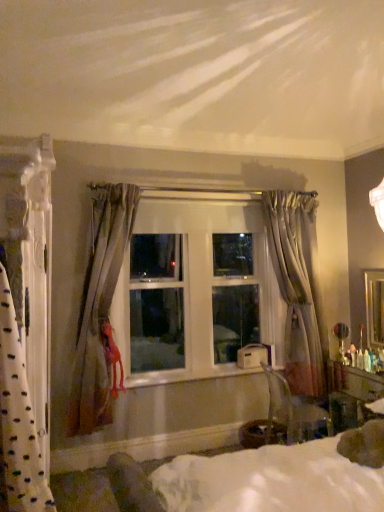
Where is `white textured curtain at left, which appears as the third curtain when viewed from the right`? Image resolution: width=384 pixels, height=512 pixels. white textured curtain at left, which appears as the third curtain when viewed from the right is located at coordinates (26, 321).

Image resolution: width=384 pixels, height=512 pixels. I want to click on white painted wood at center, so click(190, 375).

This screenshot has height=512, width=384. What do you see at coordinates (298, 287) in the screenshot?
I see `sheer gray curtain at right, which appears as the 1th curtain when viewed from the right` at bounding box center [298, 287].

Describe the element at coordinates (350, 394) in the screenshot. I see `wooden glossy vanity at lower right` at that location.

The image size is (384, 512). In order to click on silver metallic mirror at right in this screenshot , I will do `click(374, 308)`.

Find the location of a particular element. metallic silver table lamp at right is located at coordinates (341, 339).

Locate an element on the screen. The height and width of the screenshot is (512, 384). white textured curtain at left, which is counted as the first curtain, starting from the left is located at coordinates (26, 321).

Which is correct: sheer gray curtain at right, the third curtain positioned from the front, is inside silver metallic mirror at right, or outside of it?

The correct answer is: outside.

Locate an element on the screen. The image size is (384, 512). mirror located on the right of sheer gray curtain at right, the first curtain positioned from the back is located at coordinates (374, 308).

Can you confirm if sheer gray curtain at right, the first curtain positioned from the back, is wider than silver metallic mirror at right?

Indeed, sheer gray curtain at right, the first curtain positioned from the back, has a greater width compared to silver metallic mirror at right.

Does metallic silver table lamp at right turn towards white fabric bed at center?

Yes, metallic silver table lamp at right faces towards white fabric bed at center.

Is metallic silver table lamp at right in front of or behind white fabric bed at center in the image?

In the image, metallic silver table lamp at right appears behind white fabric bed at center.

In the scene shown: Which of these two, metallic silver table lamp at right or white fabric bed at center, is thinner?

metallic silver table lamp at right.

Which of these two, transparent plastic chair at lower right or white painted wood at center, is bigger?

transparent plastic chair at lower right is bigger.

Locate an element on the screen. This screenshot has height=512, width=384. chair located on the right of white painted wood at center is located at coordinates (293, 411).

Between transparent plastic chair at lower right and white painted wood at center, which one has larger width?

transparent plastic chair at lower right.

In the image, is transparent plastic chair at lower right positioned in front of or behind white painted wood at center?

Result: transparent plastic chair at lower right is positioned closer to the viewer than white painted wood at center.

Which is less distant, (x=265, y=368) or (x=167, y=342)?

Point (x=265, y=368) is positioned closer to the camera compared to point (x=167, y=342).

How different are the orientations of transparent plastic chair at lower right and white glass window at center in degrees?

They differ by 84 degrees in their facing directions.

From the image's perspective, relative to white glass window at center, is transparent plastic chair at lower right above or below?

transparent plastic chair at lower right is below white glass window at center.

Considering the sizes of objects transparent plastic chair at lower right and white glass window at center in the image provided, who is bigger, transparent plastic chair at lower right or white glass window at center?

white glass window at center.

How distant is white glass window at center from wooden glossy vanity at lower right?

white glass window at center and wooden glossy vanity at lower right are 4.32 feet apart.

Is white glass window at center to the left of wooden glossy vanity at lower right from the viewer's perspective?

Correct, you'll find white glass window at center to the left of wooden glossy vanity at lower right.

From a real-world perspective, who is located higher, white glass window at center or wooden glossy vanity at lower right?

white glass window at center.

Is white glass window at center behind wooden glossy vanity at lower right?

Yes, white glass window at center is behind wooden glossy vanity at lower right.

Is wooden glossy vanity at lower right shorter than white textured curtain at left, which appears as the 3th curtain when viewed from the back?

Yes.

Who is smaller, wooden glossy vanity at lower right or white textured curtain at left, which is counted as the first curtain, starting from the left?

wooden glossy vanity at lower right.

Would you say wooden glossy vanity at lower right is outside white textured curtain at left, which is counted as the first curtain, starting from the left?

Yes, wooden glossy vanity at lower right is located beyond the bounds of white textured curtain at left, which is counted as the first curtain, starting from the left.

Would you say wooden glossy vanity at lower right is to the left or to the right of white textured curtain at left, which appears as the 3th curtain when viewed from the back, in the picture?

Clearly, wooden glossy vanity at lower right is on the right of white textured curtain at left, which appears as the 3th curtain when viewed from the back, in the image.

Is white painted wood at center positioned with its back to transparent plastic chair at lower right?

That's not correct — white painted wood at center is not looking away from transparent plastic chair at lower right.

Considering the positions of objects white painted wood at center and transparent plastic chair at lower right in the image provided, who is more to the left, white painted wood at center or transparent plastic chair at lower right?

From the viewer's perspective, white painted wood at center appears more on the left side.

Is white painted wood at center with transparent plastic chair at lower right?

white painted wood at center and transparent plastic chair at lower right are not in contact.

Identify the location of mirror located below the sheer gray curtain at right, the 3th curtain in the left-to-right sequence (from the image's perspective). (374, 308).

The width and height of the screenshot is (384, 512). Identify the location of table lamp above the white fabric bed at center (from a real-world perspective). (341, 339).

Considering their positions, is white fabric bed at center positioned closer to transparent plastic chair at lower right than white textured curtain at left, which is counted as the first curtain, starting from the left?

white fabric bed at center lies closer to transparent plastic chair at lower right than the other object.

Based on their spatial positions, is silver metallic mirror at right or transparent plastic chair at lower right further from white fabric bed at center?

silver metallic mirror at right.

Looking at the image, which one is located further to white textured curtain at left, which appears as the 3th curtain when viewed from the back, white fabric bed at center or metallic silver table lamp at right?

The object further to white textured curtain at left, which appears as the 3th curtain when viewed from the back, is metallic silver table lamp at right.

Based on the photo, from the image, which object appears to be farther from silky beige curtain at center, which appears as the second curtain when viewed from the back, wooden glossy vanity at lower right or white painted wood at center?

Based on the image, wooden glossy vanity at lower right appears to be further to silky beige curtain at center, which appears as the second curtain when viewed from the back.

Considering their positions, is white textured curtain at left, which appears as the third curtain when viewed from the right, positioned further to transparent plastic chair at lower right than white painted wood at center?

Among the two, white textured curtain at left, which appears as the third curtain when viewed from the right, is located further to transparent plastic chair at lower right.

From the image, which object appears to be farther from transparent plastic chair at lower right, wooden glossy vanity at lower right or white textured curtain at left, which is counted as the first curtain, starting from the left?

white textured curtain at left, which is counted as the first curtain, starting from the left, lies further to transparent plastic chair at lower right than the other object.

Considering their positions, is wooden glossy vanity at lower right positioned closer to silky beige curtain at center, placed as the 2th curtain when sorted from left to right, than white glass window at center?

white glass window at center is closer to silky beige curtain at center, placed as the 2th curtain when sorted from left to right.

From the image, which object appears to be nearer to white textured curtain at left, which is counted as the first curtain, starting from the left, metallic silver table lamp at right or white fabric bed at center?

Among the two, white fabric bed at center is located nearer to white textured curtain at left, which is counted as the first curtain, starting from the left.

The image size is (384, 512). What are the coordinates of `table lamp positioned between white textured curtain at left, the first curtain viewed from the front, and silver metallic mirror at right from near to far` in the screenshot? It's located at (341, 339).

Locate an element on the screen. The width and height of the screenshot is (384, 512). vanity located between white fabric bed at center and white glass window at center in the depth direction is located at coordinates (350, 394).

I want to click on window between white textured curtain at left, which appears as the 3th curtain when viewed from the back, and sheer gray curtain at right, the 3th curtain in the left-to-right sequence, along the z-axis, so click(x=195, y=290).

Find the location of a particular element. chair between white fabric bed at center and white painted wood at center in the front-back direction is located at coordinates (293, 411).